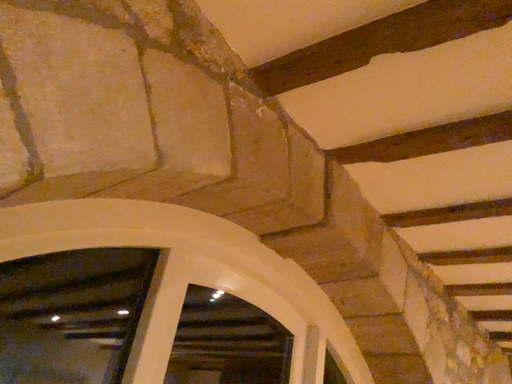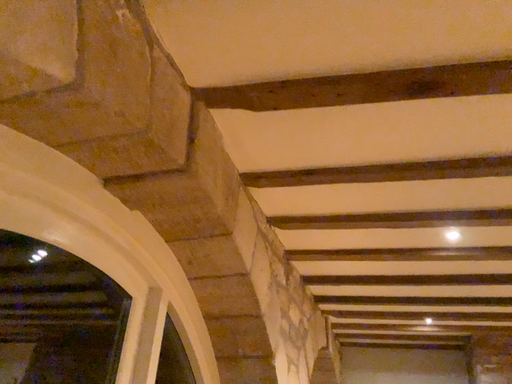
Question: How did the camera likely rotate when shooting the video?

Choices:
 (A) rotated left
 (B) rotated right

Answer: (B)